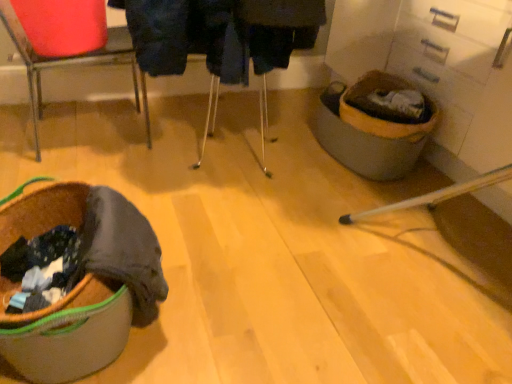
What are the coordinates of `vacant area situated below metallic red chair at upper left (from a real-world perspective)` in the screenshot? It's located at (83, 129).